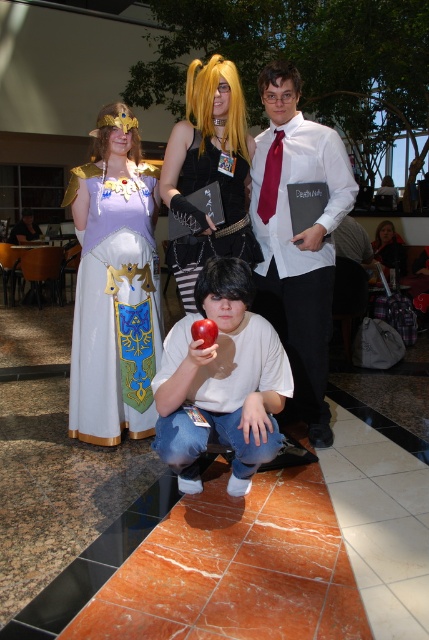
From the picture: You are a photographer trying to capture a group photo of the cosplayers. You notice the white shirt at center and the shiny black book at center. Which object should you focus on first if you want to ensure the wider one is in sharp focus?

The white shirt at center is wider than the shiny black book at center, so you should focus on the white shirt at center first to ensure it is in sharp focus.

Looking at this image, you are a photographer at a convention center. You need to take a photo of the lavender satin dress at upper left and the red matte apple at center. According to the scene, where should you position the lavender satin dress relative to the red matte apple in the photo?

The lavender satin dress at upper left is above the red matte apple at center in the photo.

You are trying to decide which costume to wear for a photoshoot. You have two options in front of you in the image. The white shirt at center and the white matte shirt at center. Which one is more likely to show wrinkles when moving around?

The white shirt at center is thinner than the white matte shirt at center, so the white shirt at center is more likely to show wrinkles when moving around because thinner fabrics tend to crease more easily.